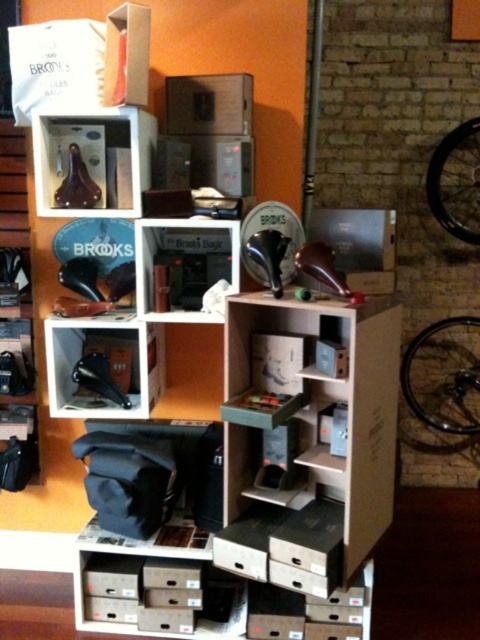
Can you confirm if silver metallic bicycle wheel at right is wider than matte cardboard box at upper center?

Yes.

Is point (462, 371) less distant than point (175, 106)?

No, it is behind (175, 106).

Where is `silver metallic bicycle wheel at right`? silver metallic bicycle wheel at right is located at coordinates (456, 180).

Does silver metallic bicycle wheel at right have a larger size compared to matte black brooks saddle at center?

Correct, silver metallic bicycle wheel at right is larger in size than matte black brooks saddle at center.

Can you confirm if silver metallic bicycle wheel at right is positioned to the left of matte black brooks saddle at center?

In fact, silver metallic bicycle wheel at right is to the right of matte black brooks saddle at center.

Which is in front, point (479, 140) or point (200, 225)?

Point (200, 225) is in front.

Where is `silver metallic bicycle wheel at right`? The image size is (480, 640). silver metallic bicycle wheel at right is located at coordinates (456, 180).

Who is more distant from viewer, (62, 355) or (206, 100)?

Point (62, 355)

Which is more to the left, matte black saddle at lower left or matte cardboard box at upper center?

From the viewer's perspective, matte black saddle at lower left appears more on the left side.

Is point (147, 403) closer to camera compared to point (215, 125)?

No, (147, 403) is further to viewer.

Identify the location of matte black saddle at lower left. Image resolution: width=480 pixels, height=640 pixels. (78, 358).